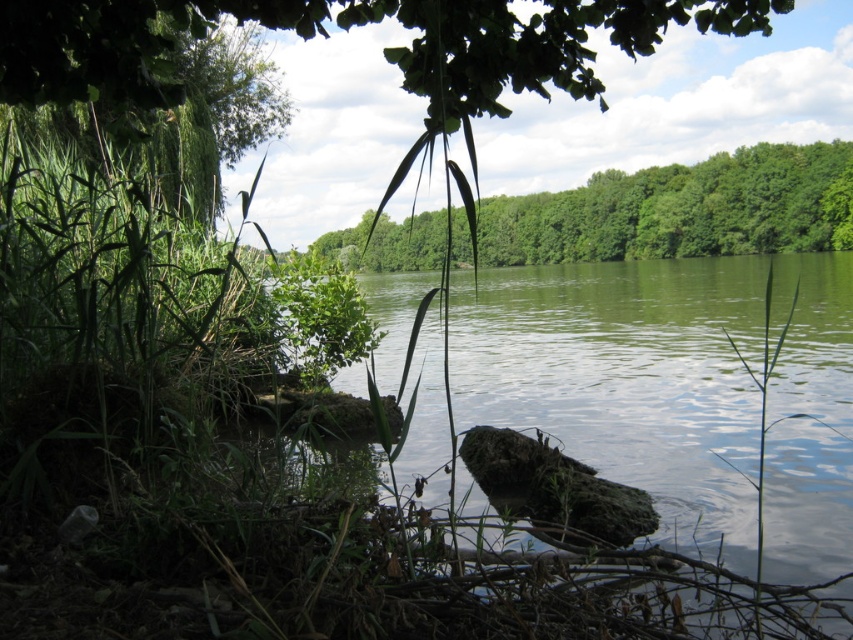
Question: Can you confirm if green mossy rock at center is thinner than green leafy tree at center?

Choices:
 (A) no
 (B) yes

Answer: (B)

Question: Which object appears closest to the camera in this image?

Choices:
 (A) green leafy tree at center
 (B) green mossy rock at center

Answer: (B)

Question: Which of the following is the closest to the observer?

Choices:
 (A) green leafy tree at center
 (B) green mossy rock at center

Answer: (B)

Question: Is green mossy rock at center positioned at the back of green leafy tree at center?

Choices:
 (A) no
 (B) yes

Answer: (A)

Question: Is green mossy rock at center further to the viewer compared to green leafy tree at center?

Choices:
 (A) yes
 (B) no

Answer: (B)